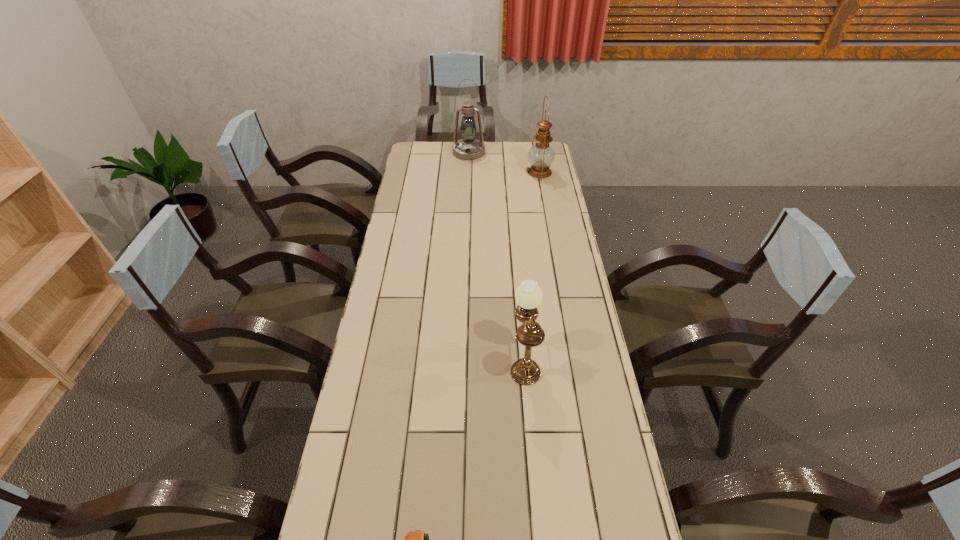
Where is `object present at the far right corner`? object present at the far right corner is located at coordinates (541, 155).

The width and height of the screenshot is (960, 540). What are the coordinates of `free region at the left edge of the desktop` in the screenshot? It's located at (371, 376).

This screenshot has width=960, height=540. What are the coordinates of `vacant space at the right edge` in the screenshot? It's located at (577, 308).

The height and width of the screenshot is (540, 960). Identify the location of unoccupied area between the second nearest oil lamp and the second nearest object. (532, 266).

Identify the location of free space between the farthest object and the third nearest object. (504, 162).

Where is `vacant space that's between the second nearest object and the third nearest object`? This screenshot has width=960, height=540. vacant space that's between the second nearest object and the third nearest object is located at coordinates [532, 266].

Identify the location of free spot between the third tallest object and the farthest oil lamp. The image size is (960, 540). (x=496, y=255).

Choose which object is the second nearest neighbor to the rightmost object. Please provide its 2D coordinates. Your answer should be formatted as a tuple, i.e. [(x, y)], where the tuple contains the x and y coordinates of a point satisfying the conditions above.

[(525, 371)]

What are the coordinates of `object that is the second closest to the second nearest oil lamp` in the screenshot? It's located at (525, 371).

Identify the location of oil lamp that is the second closest to the second oil lamp from left to right. The height and width of the screenshot is (540, 960). (468, 148).